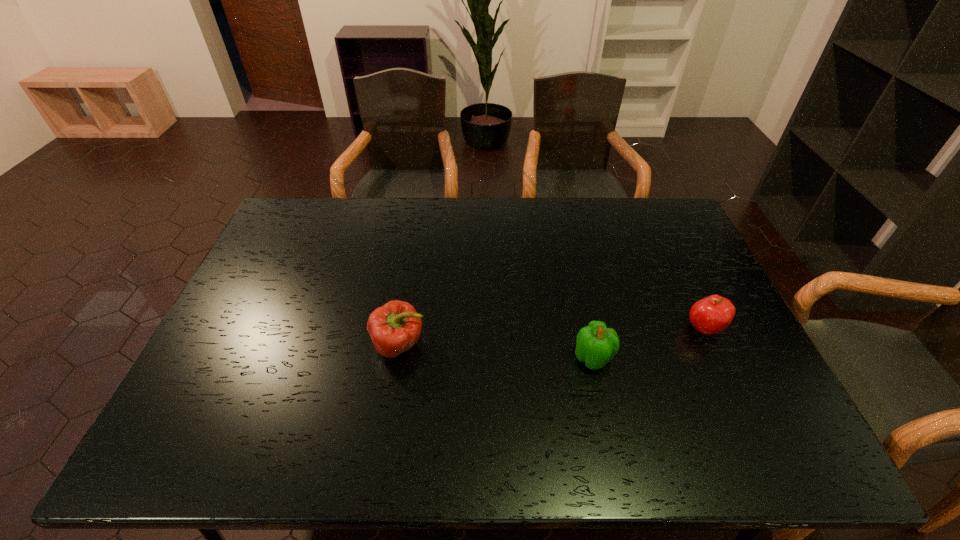
Locate an element on the screen. free space between the apple and the shorter bell pepper is located at coordinates (648, 343).

Identify the location of empty space between the second object from left to right and the apple. Image resolution: width=960 pixels, height=540 pixels. (648, 343).

Where is `free area in between the right bell pepper and the apple`? free area in between the right bell pepper and the apple is located at coordinates click(648, 343).

Locate an element on the screen. free spot between the left bell pepper and the right bell pepper is located at coordinates (496, 352).

The height and width of the screenshot is (540, 960). I want to click on free space between the right bell pepper and the left bell pepper, so click(496, 352).

The image size is (960, 540). Identify the location of object that is the closest to the right bell pepper. pos(713,314).

Select which object appears as the closest to the apple. Please provide its 2D coordinates. Your answer should be formatted as a tuple, i.e. [(x, y)], where the tuple contains the x and y coordinates of a point satisfying the conditions above.

[(596, 344)]

The height and width of the screenshot is (540, 960). Identify the location of vacant position in the image that satisfies the following two spatial constraints: 1. on the back side of the apple; 2. on the right side of the leftmost object. (402, 328).